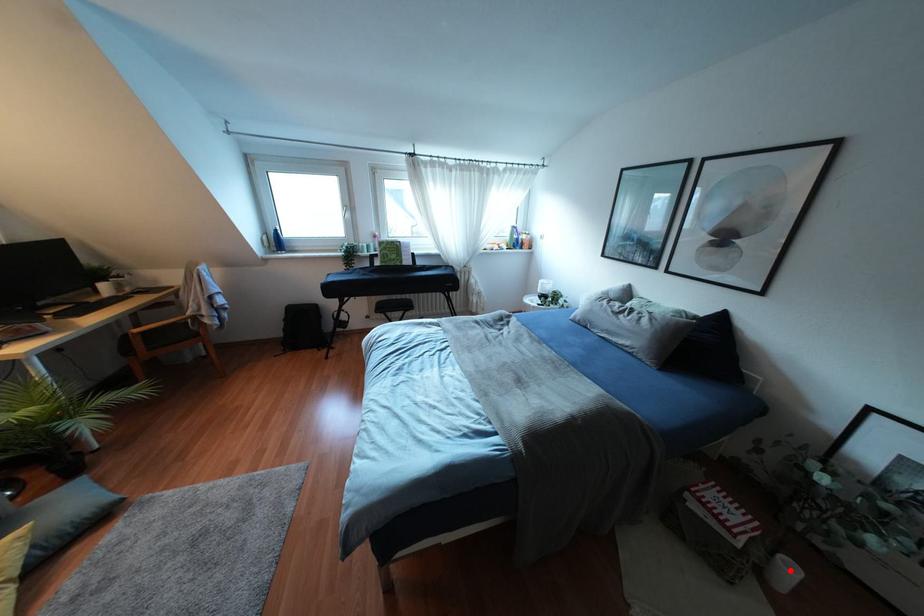
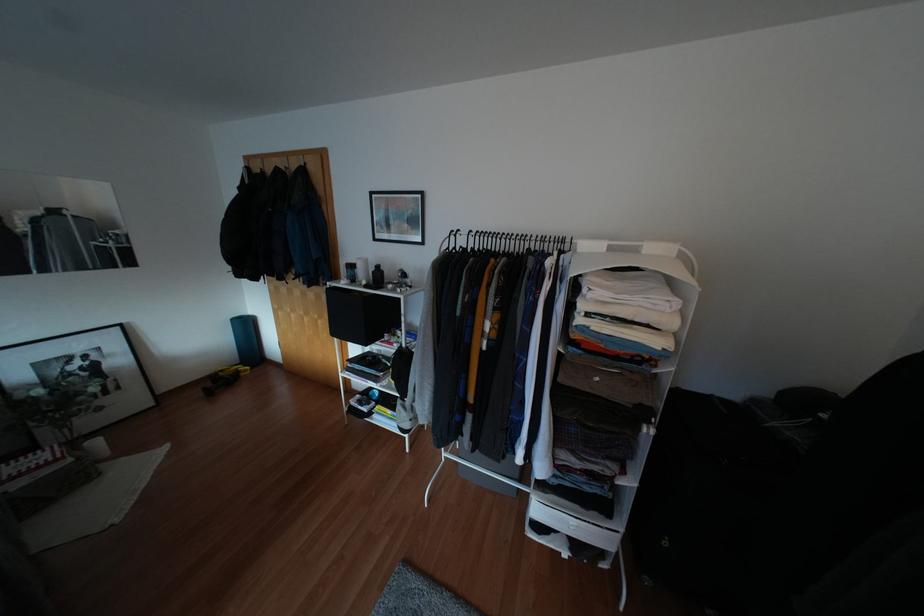
Question: I am providing you with two images of the same scene from different viewpoints. A red point is shown in image1. For the corresponding object point in image2, is it positioned nearer or farther from the camera?

Choices:
 (A) Nearer
 (B) Farther

Answer: (B)